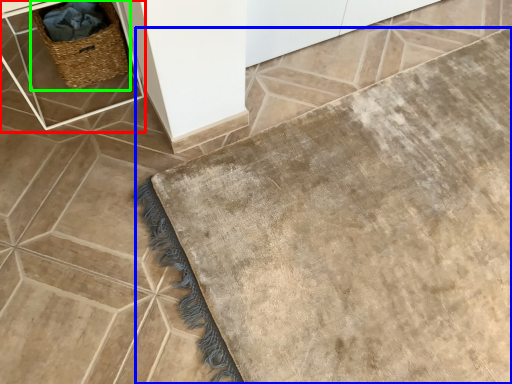
Question: Considering the real-world distances, which object is closest to table (highlighted by a red box)? bath mat (highlighted by a blue box) or picnic basket (highlighted by a green box).

Choices:
 (A) bath mat
 (B) picnic basket

Answer: (B)